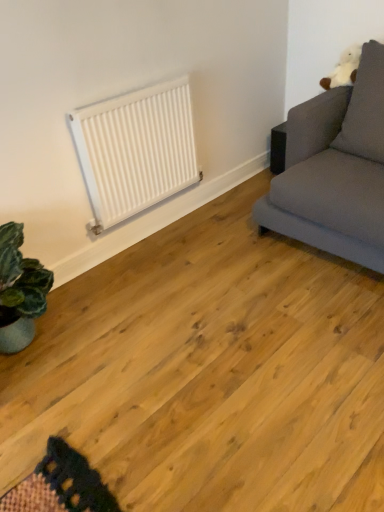
Question: Is gray fabric couch at upper right smaller than white matte radiator at upper center?

Choices:
 (A) yes
 (B) no

Answer: (B)

Question: Is gray fabric couch at upper right bigger than white matte radiator at upper center?

Choices:
 (A) yes
 (B) no

Answer: (A)

Question: From the image's perspective, is gray fabric couch at upper right on top of white matte radiator at upper center?

Choices:
 (A) yes
 (B) no

Answer: (A)

Question: Would you say white matte radiator at upper center is part of gray fabric couch at upper right's contents?

Choices:
 (A) no
 (B) yes

Answer: (A)

Question: From a real-world perspective, is gray fabric couch at upper right below white matte radiator at upper center?

Choices:
 (A) no
 (B) yes

Answer: (B)

Question: Is white plush pillow at upper right wider or thinner than gray fabric couch at upper right?

Choices:
 (A) thin
 (B) wide

Answer: (A)

Question: From a real-world perspective, is white plush pillow at upper right physically located above or below gray fabric couch at upper right?

Choices:
 (A) above
 (B) below

Answer: (A)

Question: From the image's perspective, relative to gray fabric couch at upper right, is white plush pillow at upper right above or below?

Choices:
 (A) below
 (B) above

Answer: (B)

Question: Would you say white plush pillow at upper right is to the left or to the right of gray fabric couch at upper right in the picture?

Choices:
 (A) left
 (B) right

Answer: (A)

Question: Is white matte radiator at upper center bigger or smaller than white plush pillow at upper right?

Choices:
 (A) big
 (B) small

Answer: (B)

Question: Is white matte radiator at upper center situated inside white plush pillow at upper right or outside?

Choices:
 (A) inside
 (B) outside

Answer: (B)

Question: From the image's perspective, relative to white plush pillow at upper right, is white matte radiator at upper center above or below?

Choices:
 (A) above
 (B) below

Answer: (B)

Question: Is white matte radiator at upper center wider or thinner than white plush pillow at upper right?

Choices:
 (A) wide
 (B) thin

Answer: (B)

Question: Is white plush pillow at upper right in front of or behind white matte radiator at upper center in the image?

Choices:
 (A) behind
 (B) front

Answer: (B)

Question: Considering the positions of white plush pillow at upper right and white matte radiator at upper center in the image, is white plush pillow at upper right taller or shorter than white matte radiator at upper center?

Choices:
 (A) short
 (B) tall

Answer: (B)